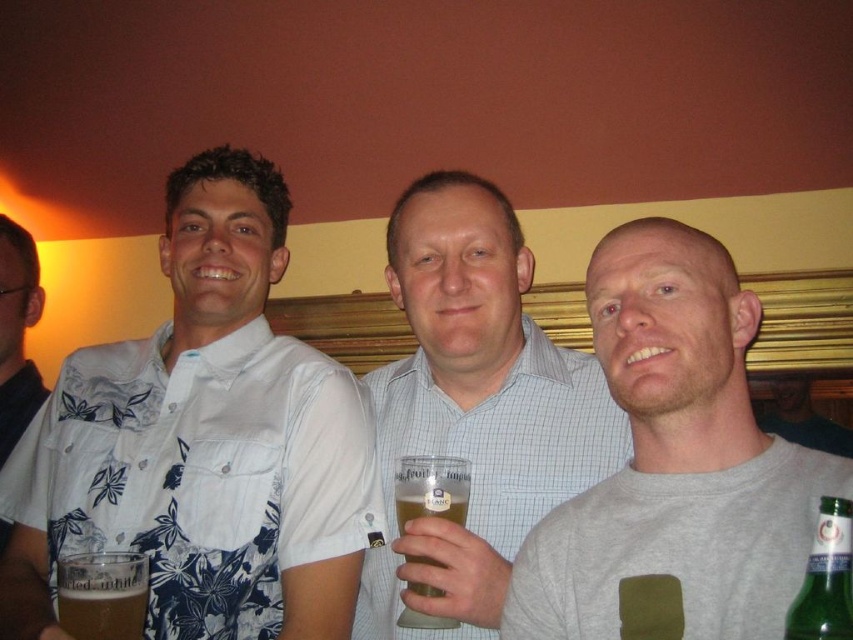
Question: Is white floral shirt at center to the right of translucent glass mug at center from the viewer's perspective?

Choices:
 (A) no
 (B) yes

Answer: (A)

Question: Which point appears farthest from the camera in this image?

Choices:
 (A) (653, 483)
 (B) (4, 422)
 (C) (399, 518)

Answer: (B)

Question: Which point is closer to the camera taking this photo?

Choices:
 (A) (682, 336)
 (B) (831, 566)
 (C) (376, 548)

Answer: (B)

Question: Can you confirm if white floral shirt at left is positioned to the left of translucent glass mug at lower left?

Choices:
 (A) yes
 (B) no

Answer: (A)

Question: Considering the real-world distances, which object is farthest from the translucent glass mug at center?

Choices:
 (A) translucent glass mug at lower left
 (B) gray matte t-shirt at center
 (C) gray matte shirt at center

Answer: (C)

Question: Is gray matte t-shirt at center thinner than checkered fabric shirt at center?

Choices:
 (A) no
 (B) yes

Answer: (B)